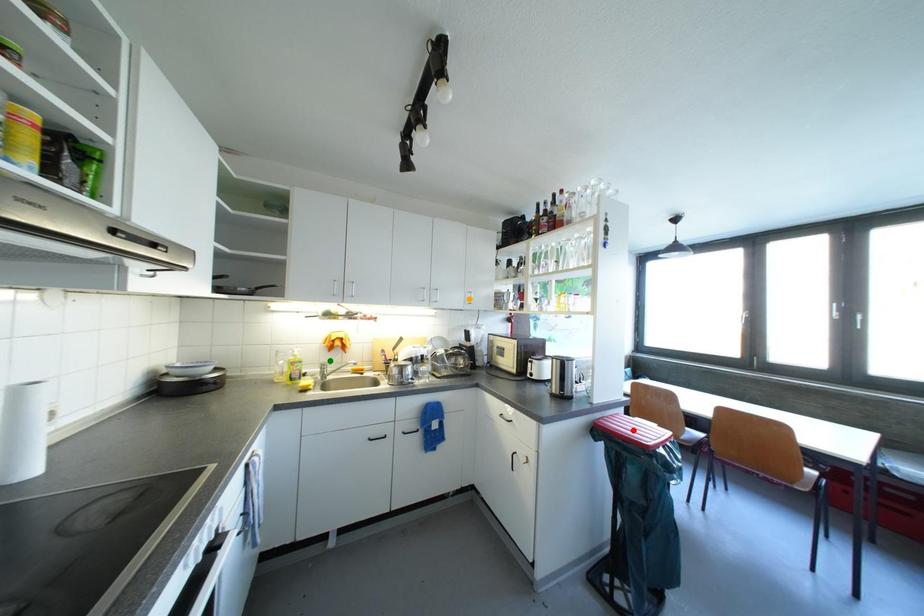
Order these from nearest to farthest:
green point
orange point
red point

1. orange point
2. green point
3. red point